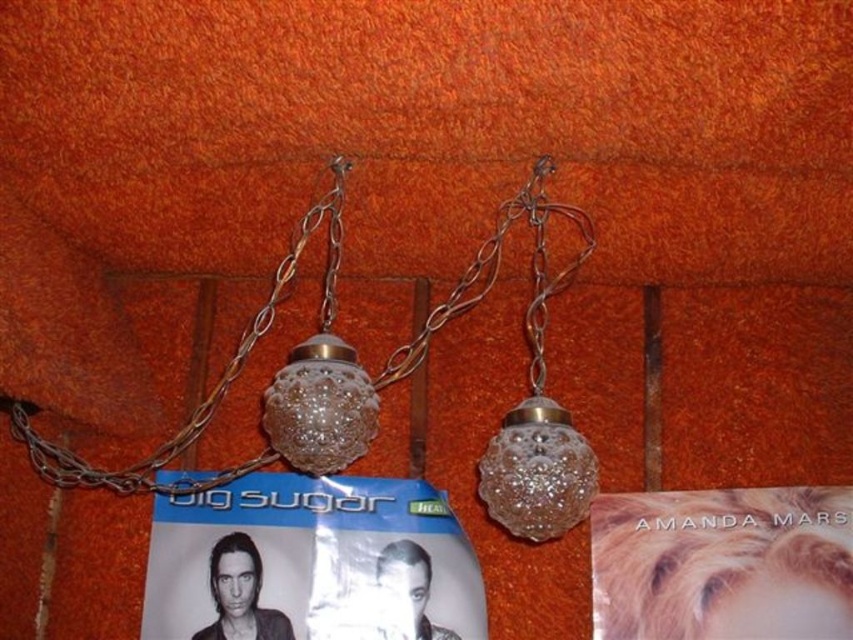
Question: Among these points, which one is nearest to the camera?

Choices:
 (A) (184, 490)
 (B) (436, 598)
 (C) (292, 396)

Answer: (C)

Question: Does matte paper poster at center come in front of clear glass globe at center?

Choices:
 (A) no
 (B) yes

Answer: (A)

Question: Is matte paper poster at center below metallic chain at left?

Choices:
 (A) no
 (B) yes

Answer: (B)

Question: Which object is the farthest from the matte paper poster at center?

Choices:
 (A) clear glass globe at center
 (B) metallic chain at left

Answer: (A)

Question: Is matte paper poster at center thinner than metallic chain at left?

Choices:
 (A) no
 (B) yes

Answer: (A)

Question: Among these points, which one is nearest to the camera?

Choices:
 (A) (219, 388)
 (B) (397, 588)
 (C) (358, 456)

Answer: (C)